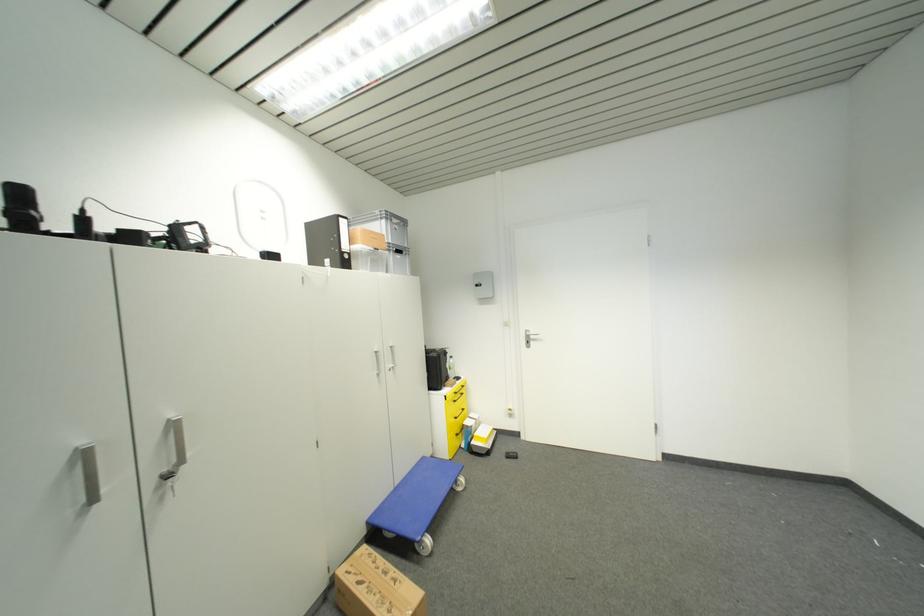
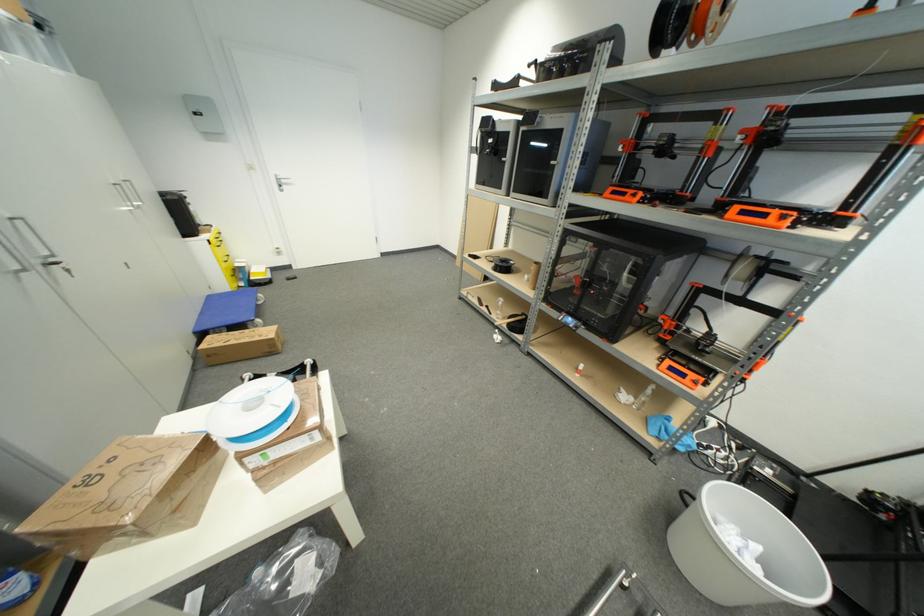
The point at (172, 479) is marked in the first image. Where is the corresponding point in the second image?

(59, 265)